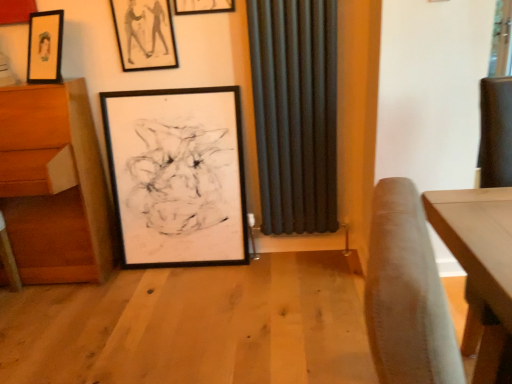
Question: Does wooden drawer at left appear on the left side of matte black picture frame at upper center, which appears as the first picture frame when viewed from the top?

Choices:
 (A) yes
 (B) no

Answer: (A)

Question: From the image's perspective, is wooden drawer at left beneath matte black picture frame at upper center, which appears as the first picture frame when viewed from the top?

Choices:
 (A) no
 (B) yes

Answer: (B)

Question: Is wooden drawer at left positioned with its back to matte black picture frame at upper center, which is counted as the 3th picture frame, starting from the bottom?

Choices:
 (A) no
 (B) yes

Answer: (A)

Question: Is wooden drawer at left smaller than matte black picture frame at upper center, which appears as the first picture frame when viewed from the top?

Choices:
 (A) yes
 (B) no

Answer: (B)

Question: Does wooden drawer at left come in front of matte black picture frame at upper center, which is counted as the 3th picture frame, starting from the bottom?

Choices:
 (A) yes
 (B) no

Answer: (A)

Question: In terms of height, does dark matte radiator at center look taller or shorter compared to black matte picture frame at center, the 1th picture frame positioned from the bottom?

Choices:
 (A) short
 (B) tall

Answer: (B)

Question: Is dark matte radiator at center situated inside black matte picture frame at center, the 1th picture frame positioned from the bottom, or outside?

Choices:
 (A) inside
 (B) outside

Answer: (B)

Question: Is point (286, 228) closer or farther from the camera than point (223, 251)?

Choices:
 (A) farther
 (B) closer

Answer: (B)

Question: Is dark matte radiator at center bigger or smaller than black matte picture frame at center, acting as the third picture frame starting from the top?

Choices:
 (A) small
 (B) big

Answer: (A)

Question: Is black matte picture frame at center, the 1th picture frame positioned from the bottom, wider or thinner than matte black picture frame at upper center, the second picture frame when ordered from bottom to top?

Choices:
 (A) thin
 (B) wide

Answer: (B)

Question: Relative to matte black picture frame at upper center, which ranks as the second picture frame in top-to-bottom order, is black matte picture frame at center, the 1th picture frame positioned from the bottom, in front or behind?

Choices:
 (A) front
 (B) behind

Answer: (A)

Question: Considering the positions of black matte picture frame at center, acting as the third picture frame starting from the top, and matte black picture frame at upper center, the second picture frame when ordered from bottom to top, in the image, is black matte picture frame at center, acting as the third picture frame starting from the top, taller or shorter than matte black picture frame at upper center, the second picture frame when ordered from bottom to top,?

Choices:
 (A) short
 (B) tall

Answer: (B)

Question: From a real-world perspective, is black matte picture frame at center, acting as the third picture frame starting from the top, physically located above or below matte black picture frame at upper center, which ranks as the second picture frame in top-to-bottom order?

Choices:
 (A) below
 (B) above

Answer: (A)

Question: From the image's perspective, is wooden drawer at left above or below matte black picture frame at upper center, which is counted as the 3th picture frame, starting from the bottom?

Choices:
 (A) above
 (B) below

Answer: (B)

Question: Looking at their shapes, would you say wooden drawer at left is wider or thinner than matte black picture frame at upper center, which appears as the first picture frame when viewed from the top?

Choices:
 (A) wide
 (B) thin

Answer: (A)